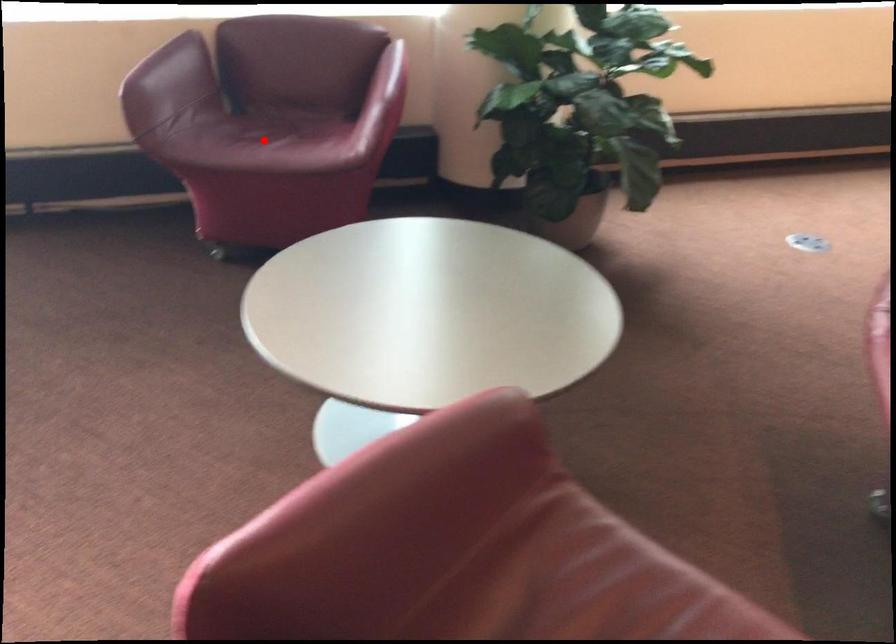
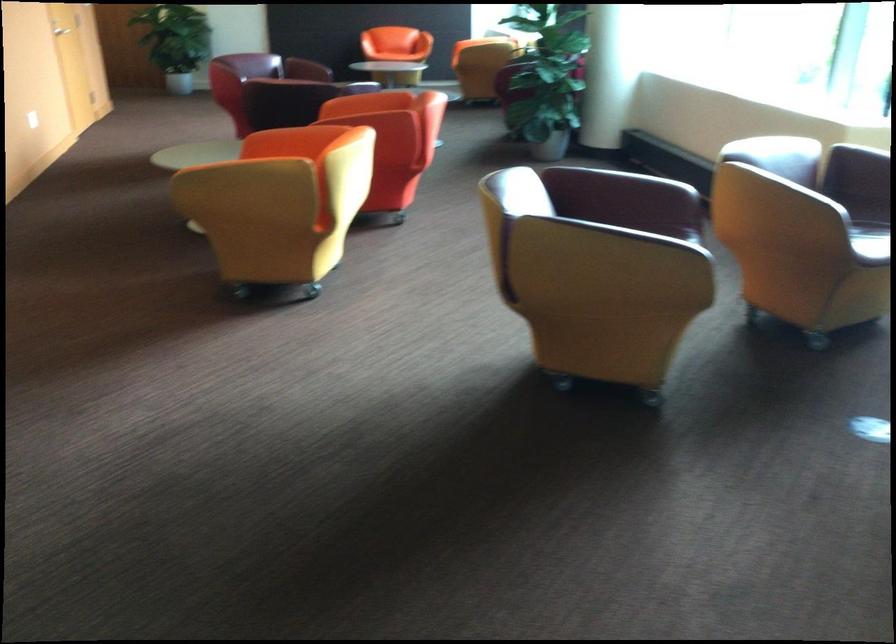
Question: I am providing you with two images of the same scene from different viewpoints. A red point is marked on the first image. At the location where the point appears in image 1, is it still visible in image 2?

Choices:
 (A) Yes
 (B) No

Answer: (B)